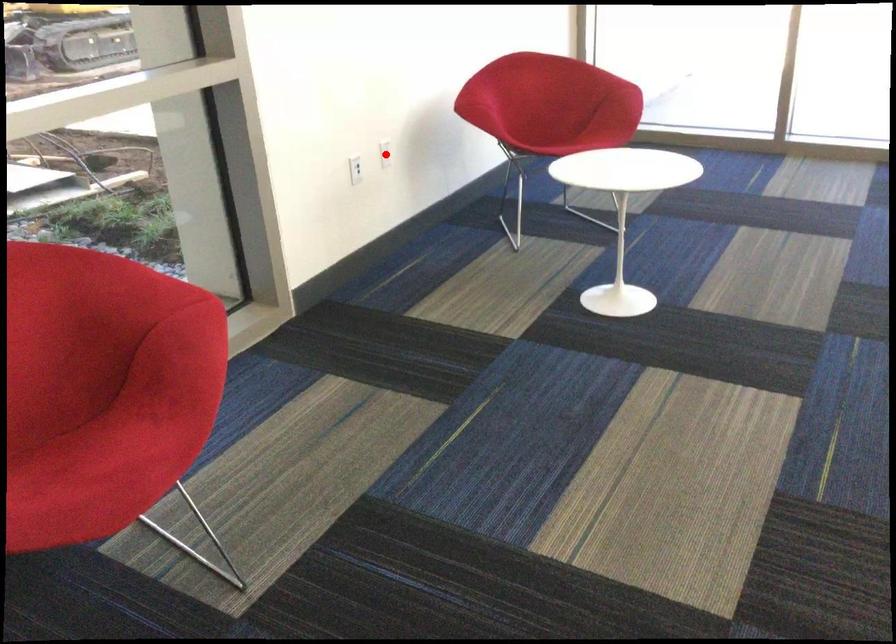
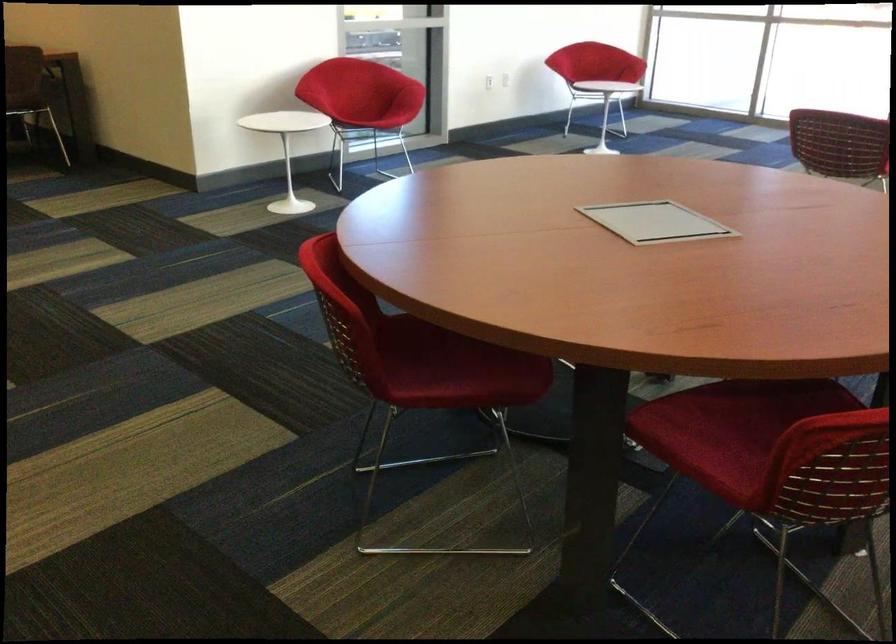
Question: I am providing you with two images of the same scene from different viewpoints. A red point is marked on the first image. At the location where the point appears in image 1, is it still visible in image 2?

Choices:
 (A) Yes
 (B) No

Answer: (B)